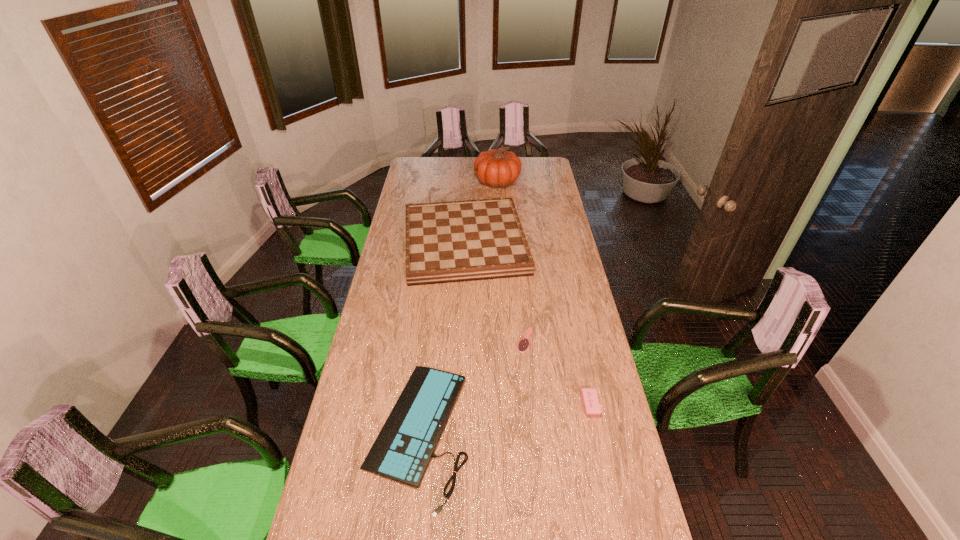
In order to click on vacant space at the far edge in this screenshot , I will do `click(460, 165)`.

The width and height of the screenshot is (960, 540). In order to click on free spot at the left edge of the desktop in this screenshot , I will do `click(402, 253)`.

In the image, there is a desktop. Where is `vacant space at the right edge`? The width and height of the screenshot is (960, 540). vacant space at the right edge is located at coordinates (567, 251).

Identify the location of vacant space at the far left corner of the desktop. (410, 173).

Where is `vacant area that lies between the second farthest object and the rightmost object`? The image size is (960, 540). vacant area that lies between the second farthest object and the rightmost object is located at coordinates (527, 323).

Identify the location of vacant area that lies between the shortest object and the eraser. (557, 372).

You are a GUI agent. You are given a task and a screenshot of the screen. Output one action in this format:
    pyautogui.click(x=<x>, y=<y>)
    Task: Click on the free spot between the fourth tallest object and the shortest object
    The width and height of the screenshot is (960, 540).
    Given the screenshot: What is the action you would take?
    pyautogui.click(x=471, y=386)

Where is `free space between the pumpkin and the computer keyboard`? free space between the pumpkin and the computer keyboard is located at coordinates (458, 307).

This screenshot has width=960, height=540. What are the coordinates of `free spot between the third nearest object and the computer keyboard` in the screenshot? It's located at (471, 386).

Locate an element on the screen. The image size is (960, 540). empty location between the second farthest object and the hairbrush is located at coordinates (495, 292).